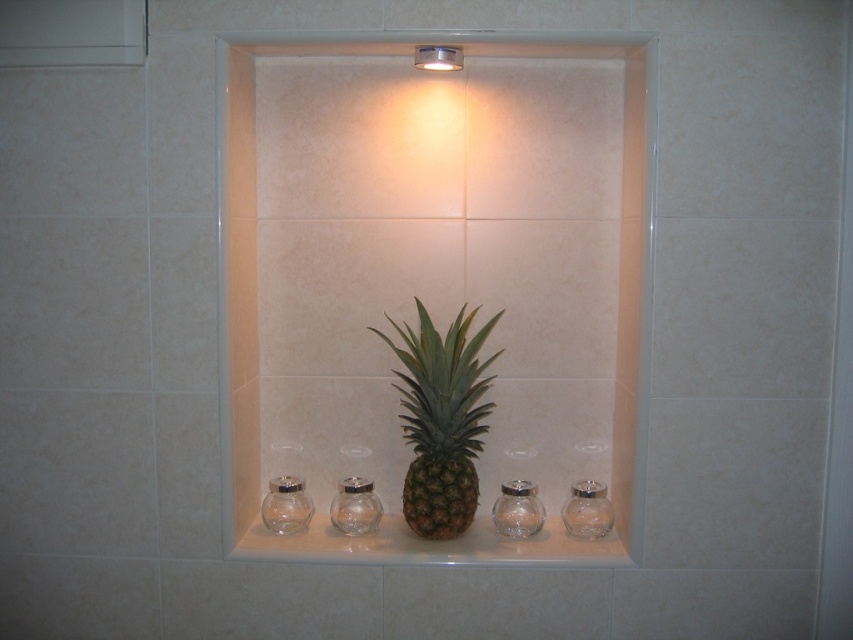
Which of these two, clear glass pineapple at center or transparent glass jar at center, stands taller?

transparent glass jar at center is taller.

Is point (552, 548) positioned after point (328, 513)?

No, it is not.

The height and width of the screenshot is (640, 853). What are the coordinates of `clear glass pineapple at center` in the screenshot? It's located at click(x=430, y=545).

Measure the distance from greenish-brown glass pineapple at center to transparent glass jar at lower left.

48.14 centimeters

Between point (496, 120) and point (296, 518), which one is positioned in front?

Point (296, 518) is more forward.

Where is `greenish-brown glass pineapple at center`? The image size is (853, 640). greenish-brown glass pineapple at center is located at coordinates (433, 273).

At what (x,y) coordinates should I click in order to perform the action: click on transparent glass jar at center. Please return your answer as a coordinate pair (x, y). Looking at the image, I should click on (355, 506).

Is transparent glass jar at center smaller than clear glass jar at center?

No, transparent glass jar at center is not smaller than clear glass jar at center.

At what (x,y) coordinates should I click in order to perform the action: click on transparent glass jar at center. Please return your answer as a coordinate pair (x, y). The height and width of the screenshot is (640, 853). Looking at the image, I should click on (355, 506).

I want to click on transparent glass jar at center, so click(x=355, y=506).